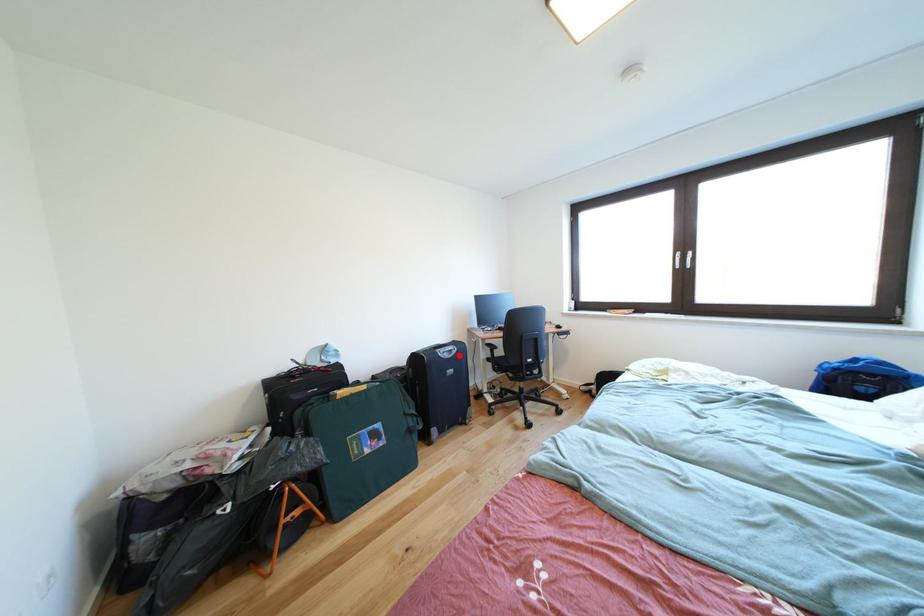
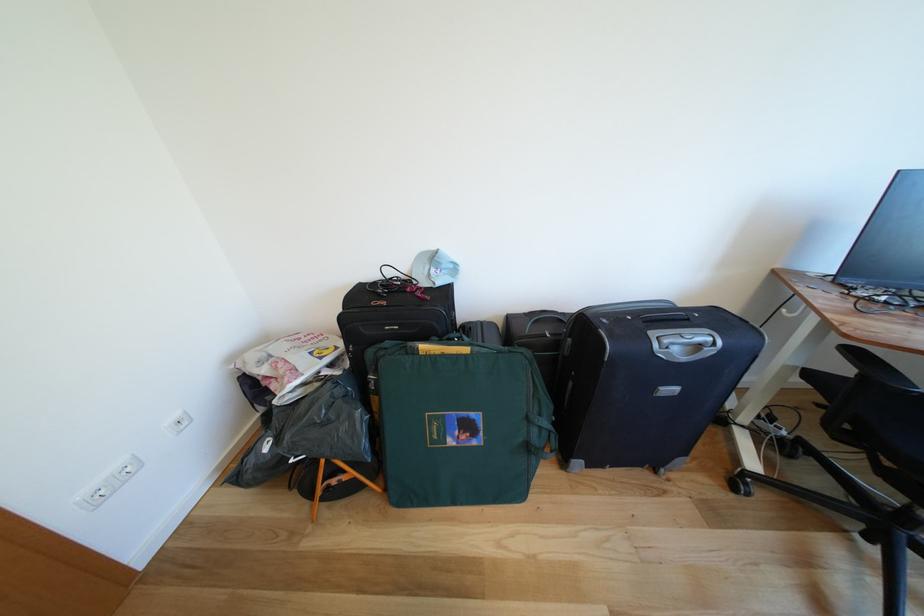
In the second image, find the point that corresponds to the highlighted location in the first image.

(707, 351)